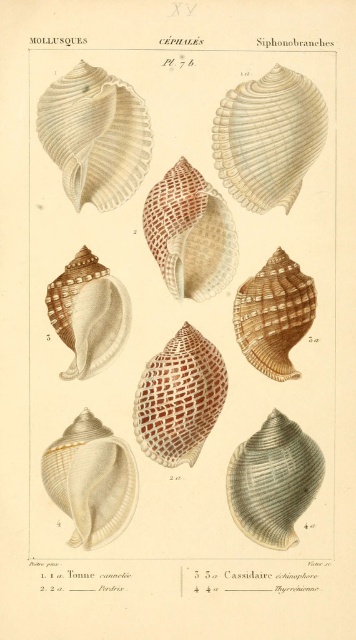
You are an underwater explorer wearing a diving suit with a 1.5 meter long arm. You see the matte brown shell at upper left in the illustration. Can you reach it with your arm?

The matte brown shell at upper left is 1.36 meters away from viewer, so yes, the explorer can reach it with their 1.5 meter long arm since the distance is shorter than the arm length.